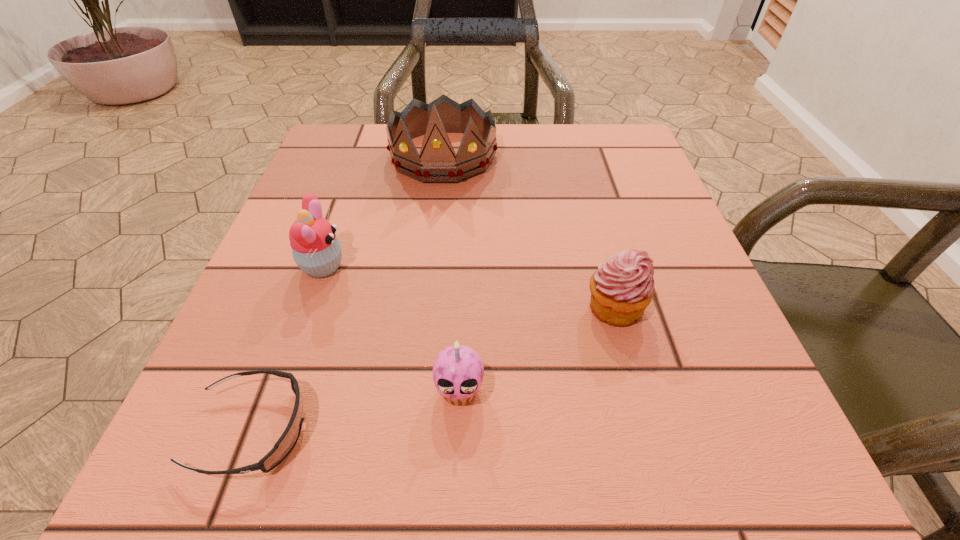
Locate an element on the screen. vacant space positioned 0.120m on the lenses of the goggles is located at coordinates (406, 430).

I want to click on object located at the far edge, so click(437, 162).

Find the location of a particular element. Image resolution: width=960 pixels, height=540 pixels. object located in the near edge section of the desktop is located at coordinates (286, 442).

The image size is (960, 540). Find the location of `tiara that is at the left edge`. tiara that is at the left edge is located at coordinates (437, 162).

Where is `cupcake that is at the left edge`? The image size is (960, 540). cupcake that is at the left edge is located at coordinates (316, 250).

Image resolution: width=960 pixels, height=540 pixels. I want to click on goggles at the left edge, so click(x=286, y=442).

Locate an element on the screen. The height and width of the screenshot is (540, 960). object located in the right edge section of the desktop is located at coordinates (621, 288).

The width and height of the screenshot is (960, 540). In order to click on object at the far left corner in this screenshot , I will do `click(437, 162)`.

This screenshot has height=540, width=960. What are the coordinates of `object at the near left corner` in the screenshot? It's located at (286, 442).

The height and width of the screenshot is (540, 960). In order to click on free space at the far edge of the desktop in this screenshot , I will do `click(513, 129)`.